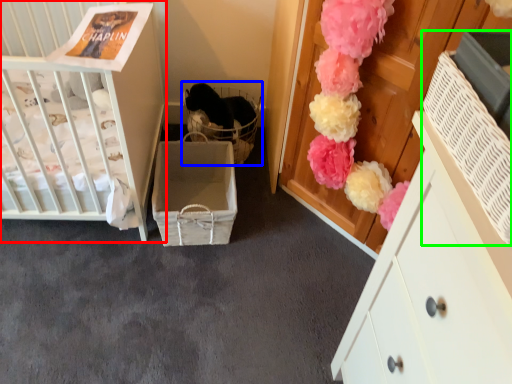
Question: Which object is positioned closest to infant bed (highlighted by a red box)? Select from baby carriage (highlighted by a blue box) and storage box (highlighted by a green box).

Choices:
 (A) baby carriage
 (B) storage box

Answer: (A)